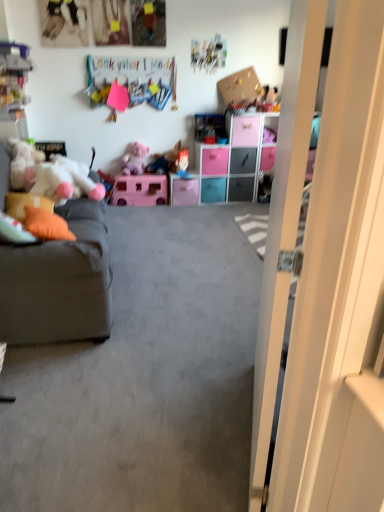
Locate an element on the screen. Image resolution: width=384 pixels, height=512 pixels. empty space that is ontop of gray carpet at center (from a real-world perspective) is located at coordinates (171, 281).